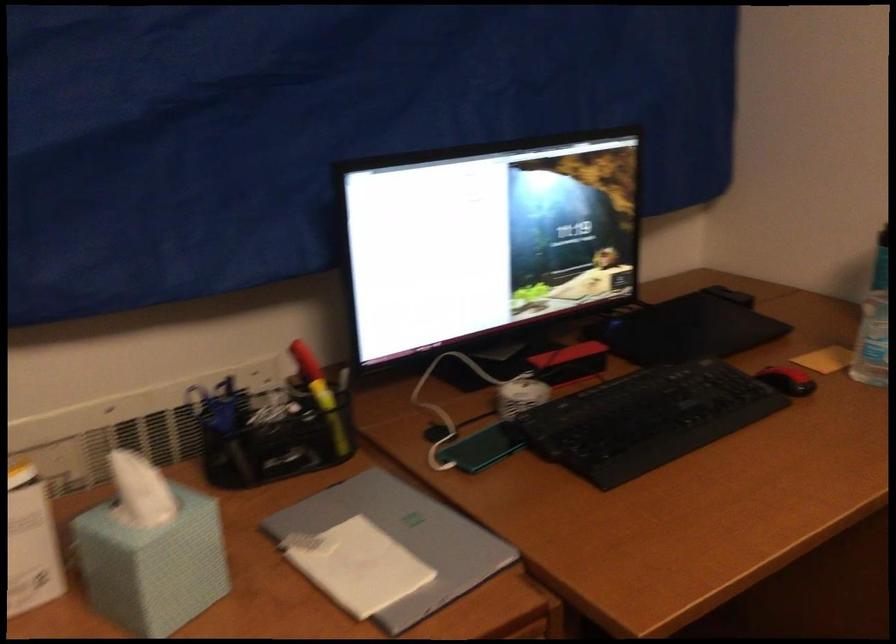
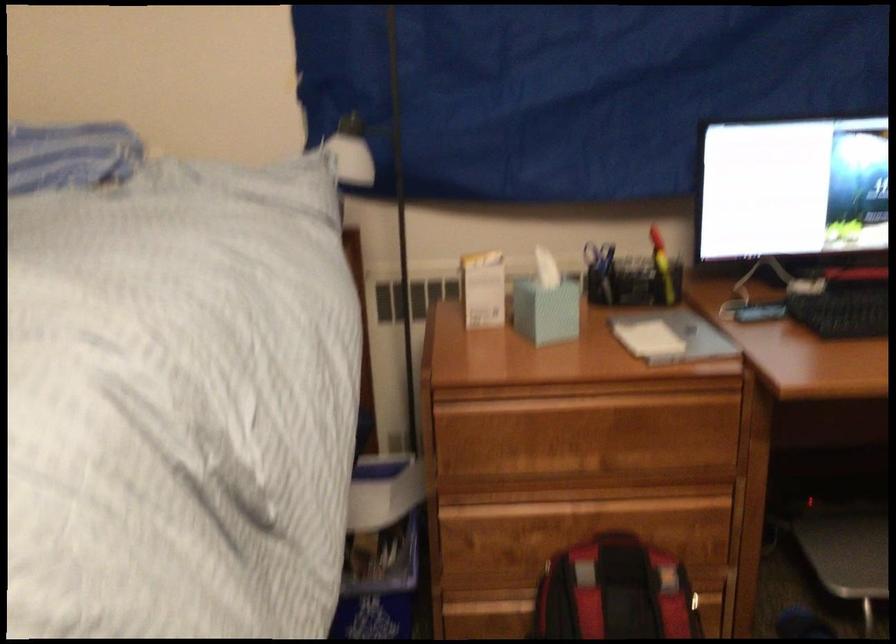
Locate, in the second image, the point that corresponds to [330,399] in the first image.

(662, 267)